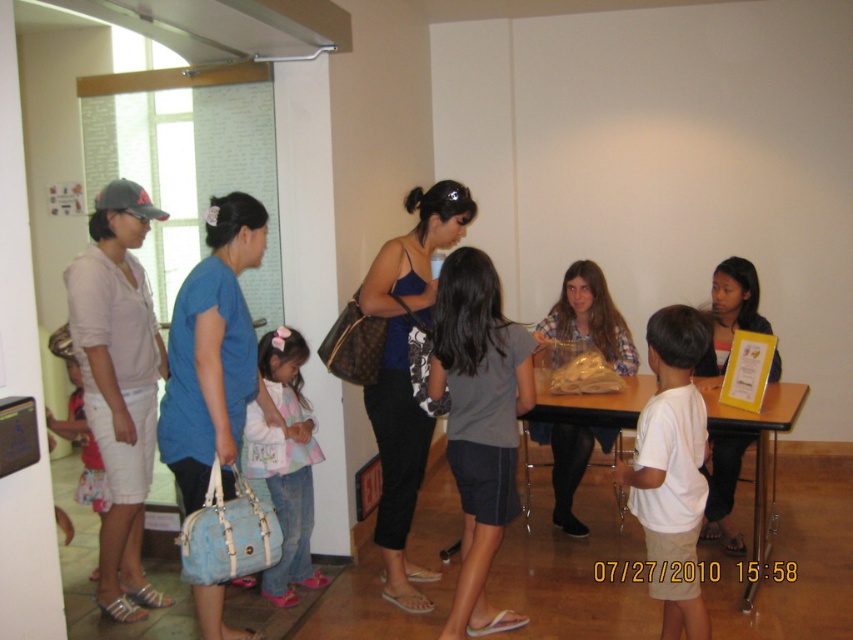
Is matte pink shirt at left above pastel striped shirt at center?

Correct, matte pink shirt at left is located above pastel striped shirt at center.

From the picture: Is matte pink shirt at left closer to the viewer compared to pastel striped shirt at center?

Yes, it is in front of pastel striped shirt at center.

This screenshot has height=640, width=853. Identify the location of matte pink shirt at left. (119, 384).

Locate an element on the screen. This screenshot has width=853, height=640. gray fabric shorts at center is located at coordinates (479, 422).

Who is more distant from viewer, (496, 320) or (584, 531)?

Point (584, 531)

Where is `gray fabric shorts at center`? The image size is (853, 640). gray fabric shorts at center is located at coordinates (479, 422).

Can you confirm if brown wooden table at center is wider than matte black shirt at center?

Correct, the width of brown wooden table at center exceeds that of matte black shirt at center.

Who is more forward, (548,417) or (723,516)?

Positioned in front is point (548,417).

Where is `brown wooden table at center`? Image resolution: width=853 pixels, height=640 pixels. brown wooden table at center is located at coordinates (759, 445).